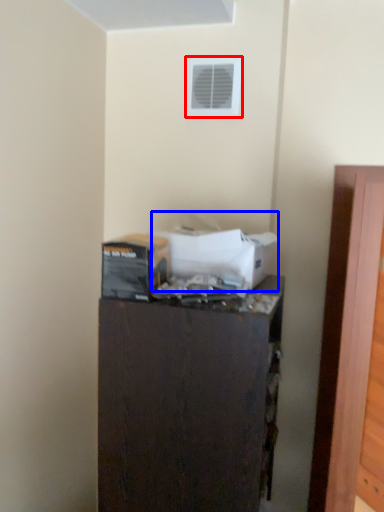
Question: Which object appears farthest to the camera in this image, air conditioning (highlighted by a red box) or box (highlighted by a blue box)?

Choices:
 (A) air conditioning
 (B) box

Answer: (A)